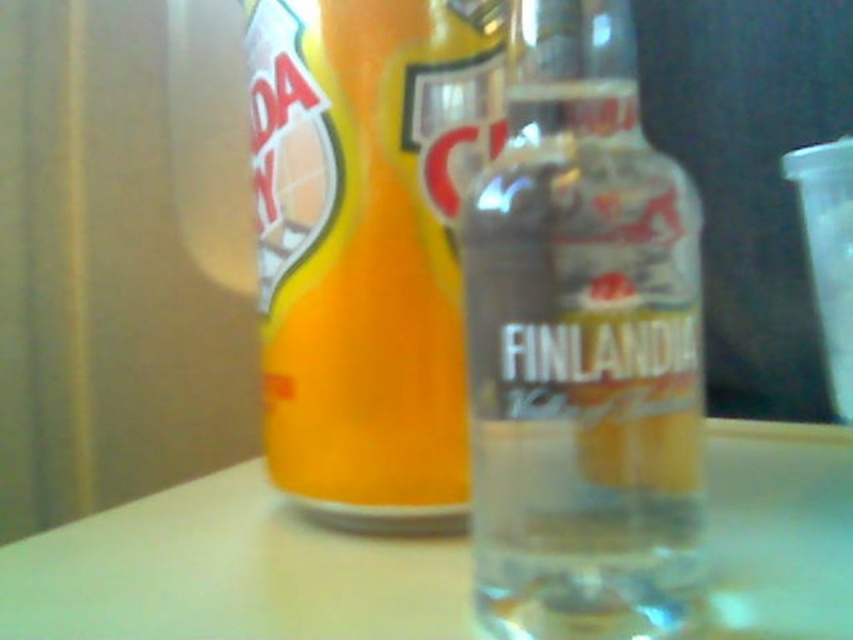
From the picture: Who is lower down, clear glass bottle at center or white glossy table at center?

white glossy table at center is lower down.

This screenshot has width=853, height=640. Identify the location of clear glass bottle at center. (x=582, y=346).

Can you confirm if orange matte can at center is smaller than white glossy table at center?

Indeed, orange matte can at center has a smaller size compared to white glossy table at center.

Can you confirm if orange matte can at center is thinner than white glossy table at center?

Yes, orange matte can at center is thinner than white glossy table at center.

You are a GUI agent. You are given a task and a screenshot of the screen. Output one action in this format:
    pyautogui.click(x=<x>, y=<y>)
    Task: Click on the orange matte can at center
    This screenshot has height=640, width=853.
    Given the screenshot: What is the action you would take?
    pyautogui.click(x=368, y=244)

Which is above, clear glass bottle at center or orange matte can at center?

orange matte can at center is above.

The image size is (853, 640). What do you see at coordinates (582, 346) in the screenshot?
I see `clear glass bottle at center` at bounding box center [582, 346].

What are the coordinates of `clear glass bottle at center` in the screenshot? It's located at (582, 346).